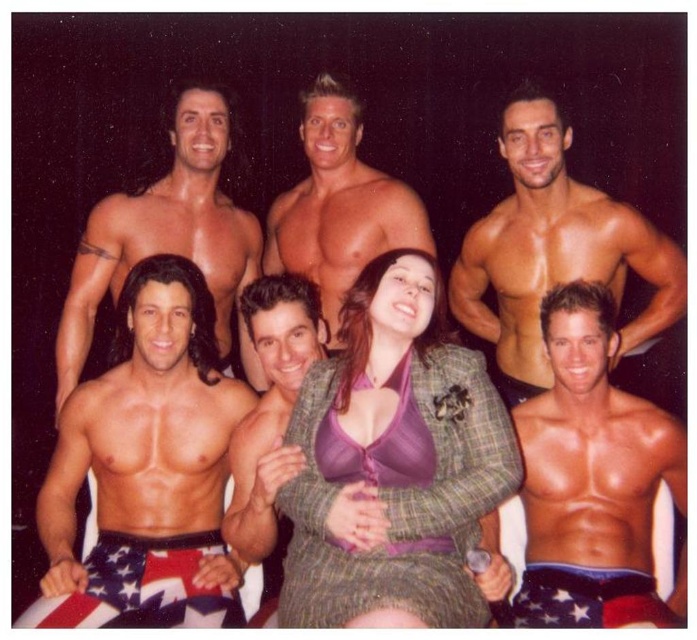
Is shiny metallic shorts at lower left bigger than muscular tan skin at upper center?

No.

Does point (135, 497) lie in front of point (560, 164)?

That is True.

This screenshot has height=640, width=697. I want to click on shiny metallic shorts at lower left, so click(x=146, y=472).

Does point (544, 360) lie in front of point (84, 333)?

Yes, it is.

Can you confirm if muscular tan skin at upper center is bigger than shiny skin torso at left?

Correct, muscular tan skin at upper center is larger in size than shiny skin torso at left.

What do you see at coordinates (553, 250) in the screenshot? The image size is (697, 640). I see `muscular tan skin at upper center` at bounding box center [553, 250].

I want to click on muscular tan skin at upper center, so click(x=553, y=250).

Is shiny skin torso at left thinner than smooth tan skin at center?

In fact, shiny skin torso at left might be wider than smooth tan skin at center.

Is point (176, 234) in front of point (309, 268)?

Yes, it is.

At what (x,y) coordinates should I click in order to perform the action: click on shiny skin torso at left. Please return your answer as a coordinate pair (x, y). The image size is (697, 640). Looking at the image, I should click on (164, 232).